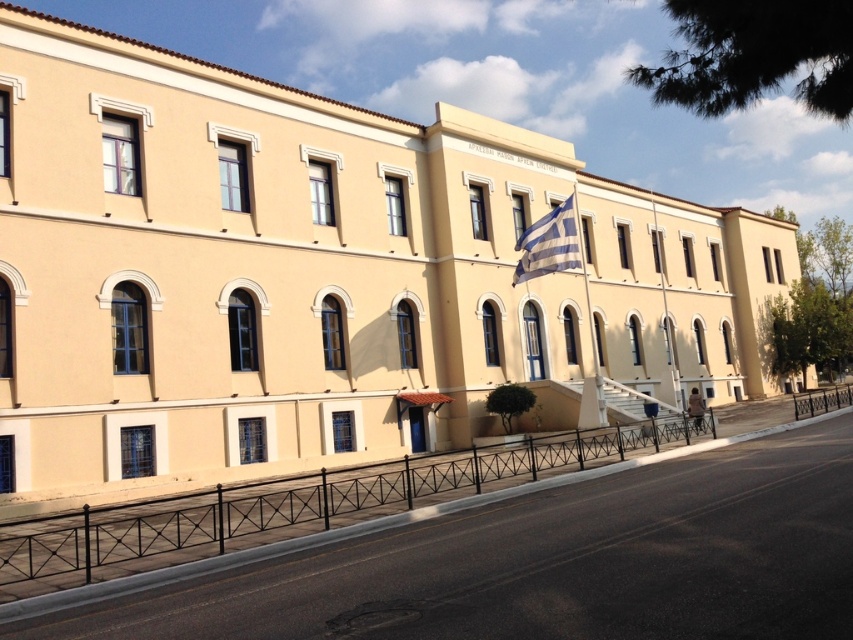
Does white fabric flag at center lie in front of black wrought iron railing at center?

No, white fabric flag at center is further to the viewer.

Which is in front, point (531, 257) or point (843, 394)?

Point (531, 257) is in front.

Between point (558, 262) and point (793, 416), which one is positioned behind?

Positioned behind is point (793, 416).

Locate an element on the screen. The height and width of the screenshot is (640, 853). white fabric flag at center is located at coordinates (549, 243).

Who is shorter, black metal fence at lower center or white fabric flag at center?

black metal fence at lower center

This screenshot has height=640, width=853. Identify the location of black metal fence at lower center. (302, 499).

Between point (294, 483) and point (846, 390), which one is positioned behind?

The point (846, 390) is more distant.

Find the location of `black metal fence at lower center`. black metal fence at lower center is located at coordinates (302, 499).